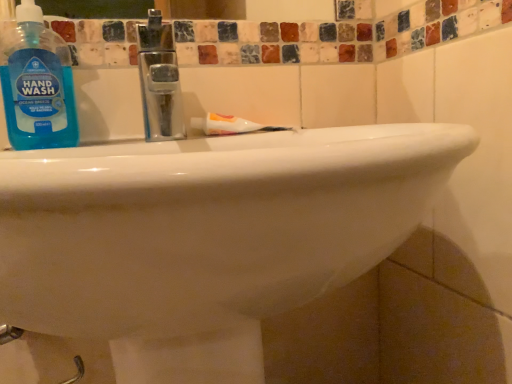
Question: Is blue translucent liquid hand wash at upper left located within white glossy toothpaste at center?

Choices:
 (A) no
 (B) yes

Answer: (A)

Question: Considering the relative positions of white glossy toothpaste at center and blue translucent liquid hand wash at upper left in the image provided, is white glossy toothpaste at center behind blue translucent liquid hand wash at upper left?

Choices:
 (A) yes
 (B) no

Answer: (A)

Question: Does white glossy toothpaste at center have a larger size compared to blue translucent liquid hand wash at upper left?

Choices:
 (A) no
 (B) yes

Answer: (A)

Question: From the image's perspective, does white glossy toothpaste at center appear lower than blue translucent liquid hand wash at upper left?

Choices:
 (A) no
 (B) yes

Answer: (B)

Question: From the image's perspective, is white glossy toothpaste at center located above blue translucent liquid hand wash at upper left?

Choices:
 (A) no
 (B) yes

Answer: (A)

Question: Does white glossy toothpaste at center have a lesser height compared to blue translucent liquid hand wash at upper left?

Choices:
 (A) yes
 (B) no

Answer: (A)

Question: From the image's perspective, does blue translucent liquid hand wash at upper left appear lower than white glossy toothpaste at center?

Choices:
 (A) no
 (B) yes

Answer: (A)

Question: Would you say blue translucent liquid hand wash at upper left is outside white glossy toothpaste at center?

Choices:
 (A) no
 (B) yes

Answer: (B)

Question: Does blue translucent liquid hand wash at upper left turn towards white glossy toothpaste at center?

Choices:
 (A) no
 (B) yes

Answer: (A)

Question: Does blue translucent liquid hand wash at upper left have a smaller size compared to white glossy toothpaste at center?

Choices:
 (A) yes
 (B) no

Answer: (B)

Question: Can you confirm if blue translucent liquid hand wash at upper left is shorter than white glossy toothpaste at center?

Choices:
 (A) yes
 (B) no

Answer: (B)

Question: Can you confirm if blue translucent liquid hand wash at upper left is positioned to the left of white glossy toothpaste at center?

Choices:
 (A) yes
 (B) no

Answer: (A)

Question: Is white glossy toothpaste at center spatially inside blue translucent liquid hand wash at upper left, or outside of it?

Choices:
 (A) inside
 (B) outside

Answer: (B)